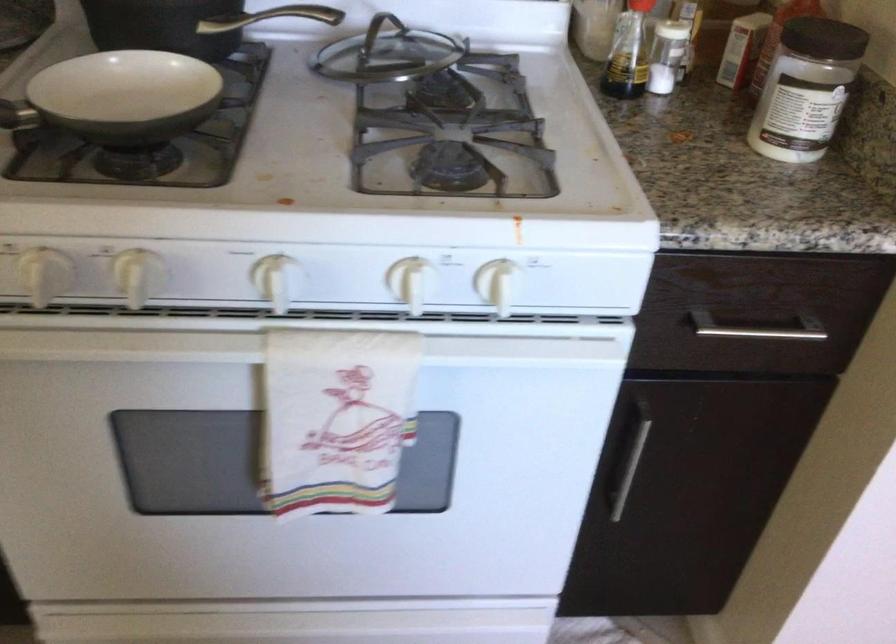
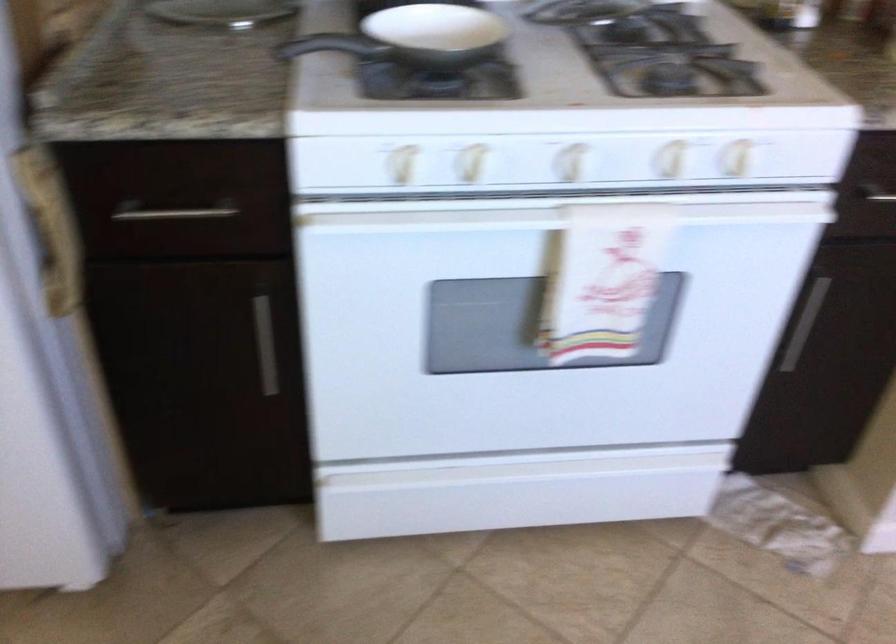
In the second image, find the point that corresponds to the point at 254,353 in the first image.

(550, 218)